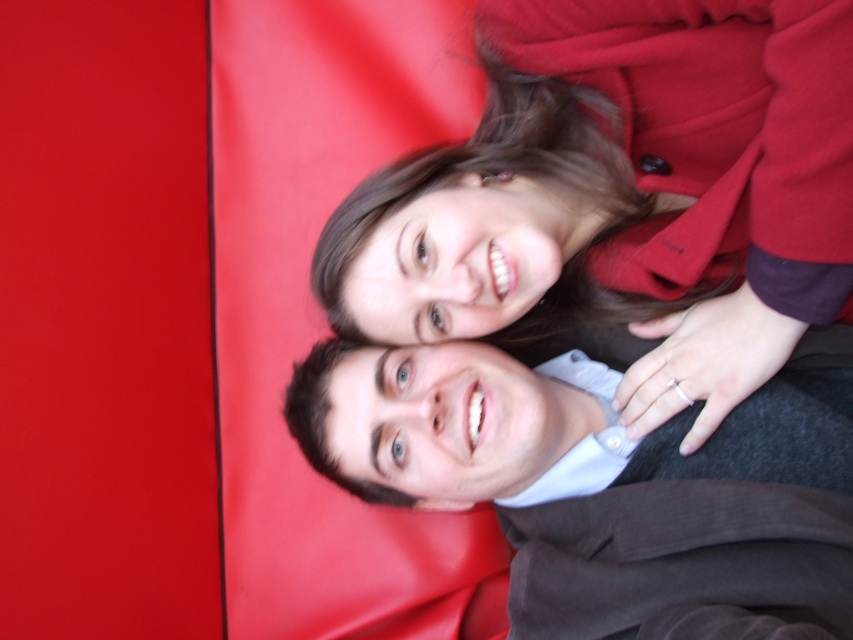
Question: Which point appears farthest from the camera in this image?

Choices:
 (A) (431, 496)
 (B) (381, 182)

Answer: (A)

Question: Does matte red coat at upper center have a larger size compared to smooth brown jacket at lower right?

Choices:
 (A) yes
 (B) no

Answer: (A)

Question: Can you confirm if matte red coat at upper center is positioned above smooth brown jacket at lower right?

Choices:
 (A) yes
 (B) no

Answer: (A)

Question: Which object is closer to the camera taking this photo?

Choices:
 (A) matte red coat at upper center
 (B) smooth brown jacket at lower right

Answer: (A)

Question: Is matte red coat at upper center below smooth brown jacket at lower right?

Choices:
 (A) yes
 (B) no

Answer: (B)